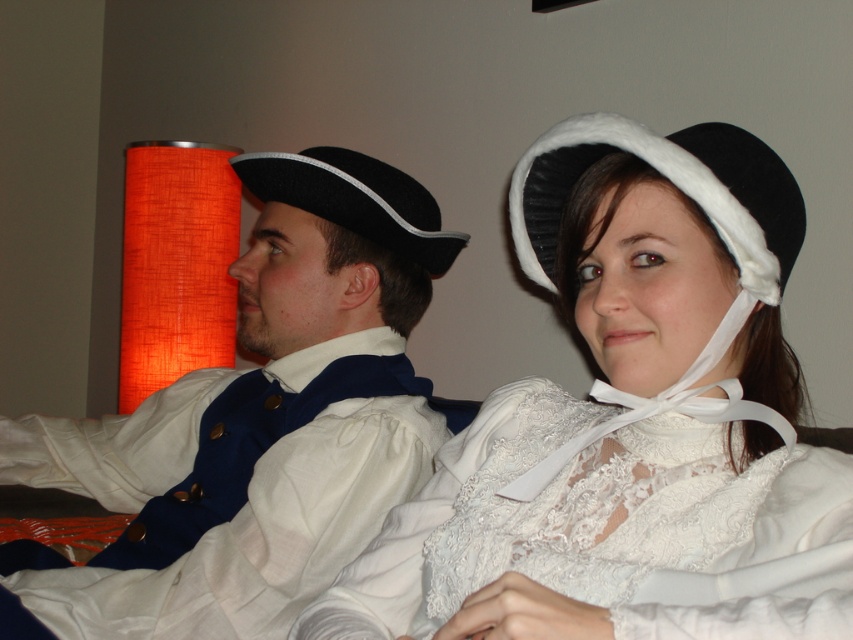
Question: Can you confirm if white lace bonnet at upper center is positioned to the right of white lace blouse at center?

Choices:
 (A) yes
 (B) no

Answer: (A)

Question: Considering the real-world distances, which object is closest to the matte black hat at upper left?

Choices:
 (A) white lace bonnet at upper center
 (B) black velvet bonnet at upper right

Answer: (A)

Question: Is black velvet bonnet at upper right smaller than black felt tricorn hat at left?

Choices:
 (A) yes
 (B) no

Answer: (A)

Question: Which point is farther to the camera?

Choices:
 (A) black felt tricorn hat at left
 (B) matte black hat at upper left
 (C) black velvet bonnet at upper right

Answer: (A)

Question: Which object is farther from the camera taking this photo?

Choices:
 (A) black felt tricorn hat at left
 (B) matte black hat at upper left

Answer: (A)

Question: Can you confirm if matte black hat at upper left is smaller than black felt tricorn hat at left?

Choices:
 (A) no
 (B) yes

Answer: (A)